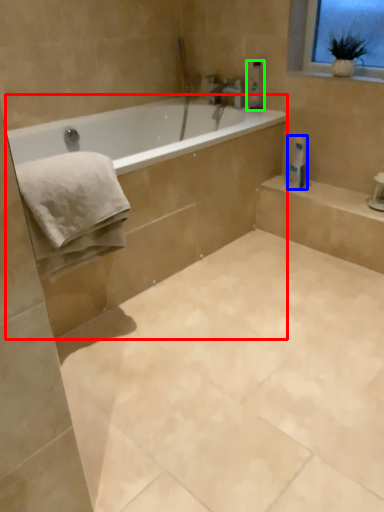
Question: Considering the real-world distances, which object is closest to bath (highlighted by a red box)? toilet paper (highlighted by a blue box) or toiletry (highlighted by a green box).

Choices:
 (A) toilet paper
 (B) toiletry

Answer: (A)